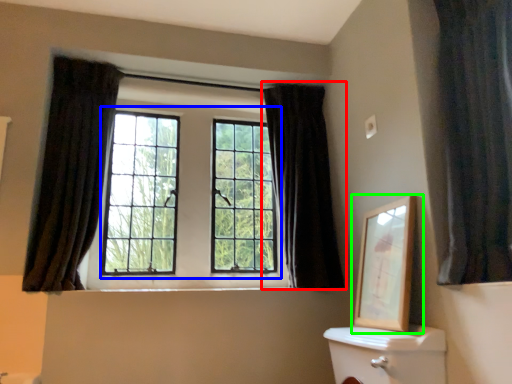
Question: Based on their relative distances, which object is farther from curtain (highlighted by a red box)? Choose from bay window (highlighted by a blue box) and picture frame (highlighted by a green box).

Choices:
 (A) bay window
 (B) picture frame

Answer: (B)